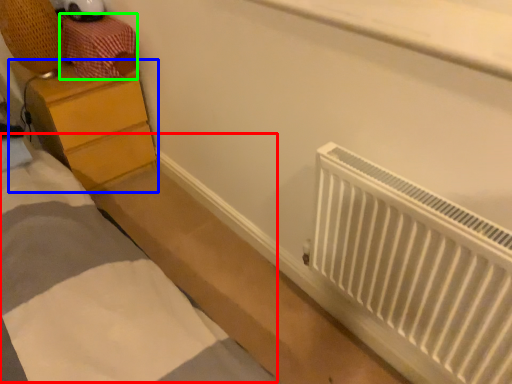
Question: Which object is positioned closest to bed (highlighted by a red box)? Select from chest of drawers (highlighted by a blue box) and drawer (highlighted by a green box).

Choices:
 (A) chest of drawers
 (B) drawer

Answer: (A)